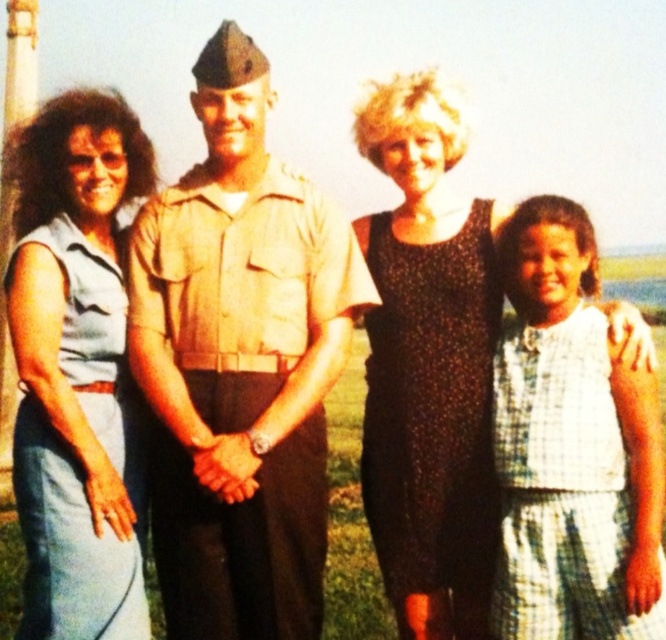
Locate an element on the screen. black dotted dress at center is located at coordinates (428, 364).

Which is more to the right, black dotted dress at center or white checkered dress at right?

Positioned to the right is white checkered dress at right.

Image resolution: width=666 pixels, height=640 pixels. Describe the element at coordinates (428, 364) in the screenshot. I see `black dotted dress at center` at that location.

Find the location of a particular element. The height and width of the screenshot is (640, 666). black dotted dress at center is located at coordinates (428, 364).

Measure the distance between point (x=222, y=362) and camera.

Point (x=222, y=362) and camera are 30.26 feet apart.

Can you confirm if khaki uniform at center is thinner than blue denim dress at left?

No.

This screenshot has height=640, width=666. What do you see at coordinates (238, 364) in the screenshot? I see `khaki uniform at center` at bounding box center [238, 364].

In order to click on khaki uniform at center in this screenshot , I will do `click(238, 364)`.

Where is `blue denim dress at left`? blue denim dress at left is located at coordinates (75, 368).

Can you confirm if blue denim dress at left is positioned above white checkered dress at right?

Yes.

Who is more forward, (25, 225) or (563, 433)?

Point (563, 433) is in front.

Where is `blue denim dress at left`? blue denim dress at left is located at coordinates tap(75, 368).